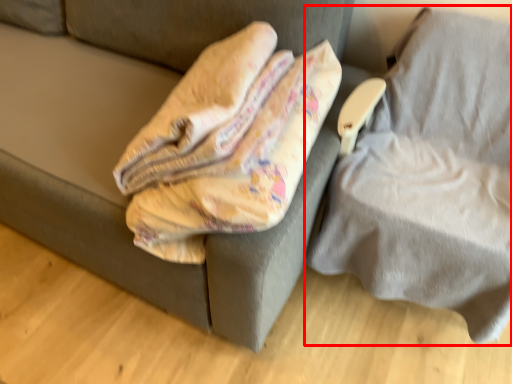
Question: Considering the relative positions of furniture (annotated by the red box) and furniture in the image provided, where is furniture (annotated by the red box) located with respect to the staircase?

Choices:
 (A) left
 (B) right

Answer: (B)